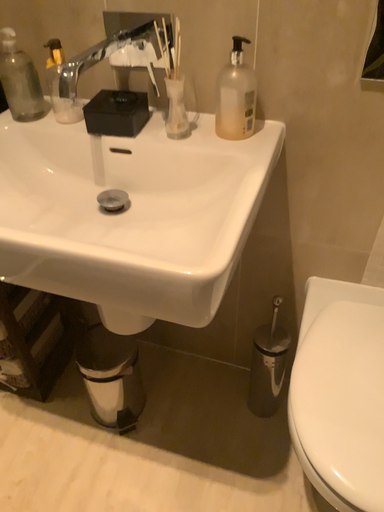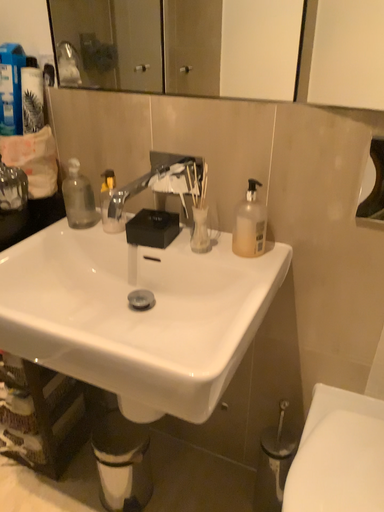
Question: How did the camera likely rotate when shooting the video?

Choices:
 (A) rotated downward
 (B) rotated upward

Answer: (B)